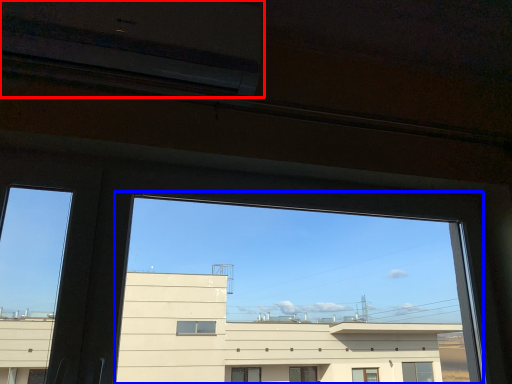
Question: Which object appears farthest to the camera in this image, air conditioning (highlighted by a red box) or train window (highlighted by a blue box)?

Choices:
 (A) air conditioning
 (B) train window

Answer: (A)